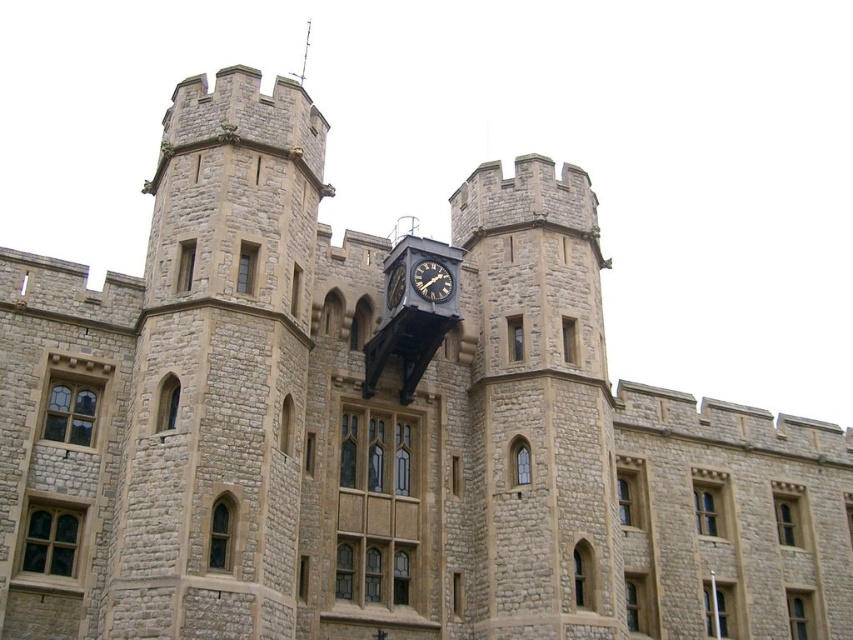
Question: Does black metal clock at center appear under gold metallic clock at center?

Choices:
 (A) yes
 (B) no

Answer: (B)

Question: Which point is farther from the camera taking this photo?

Choices:
 (A) (389, 275)
 (B) (428, 294)

Answer: (A)

Question: Among these objects, which one is farthest from the camera?

Choices:
 (A) gold metallic clock at center
 (B) black metal clock at center

Answer: (A)

Question: Is black metal clock at center above gold metallic clock at center?

Choices:
 (A) no
 (B) yes

Answer: (B)

Question: Does black metal clock at center appear on the right side of gold metallic clock at center?

Choices:
 (A) no
 (B) yes

Answer: (B)